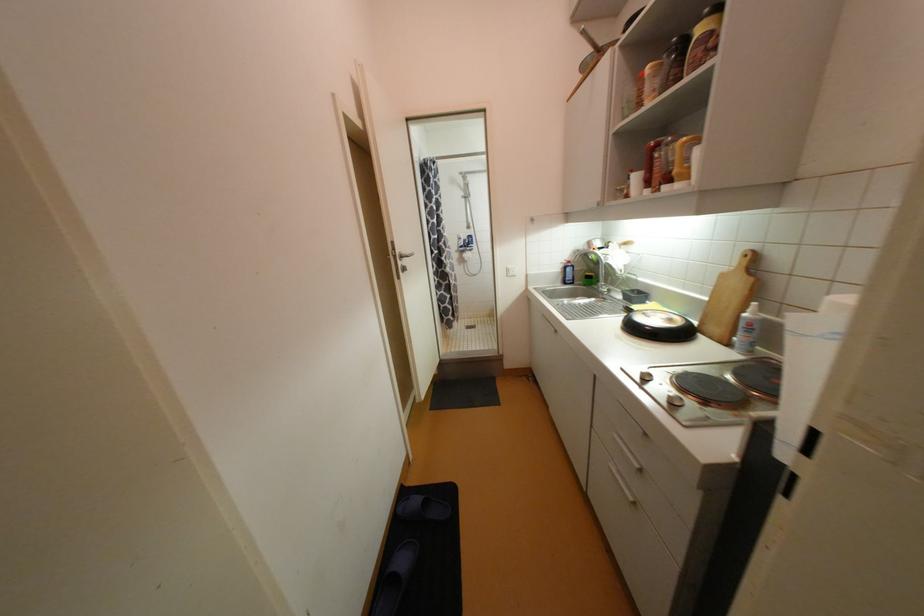
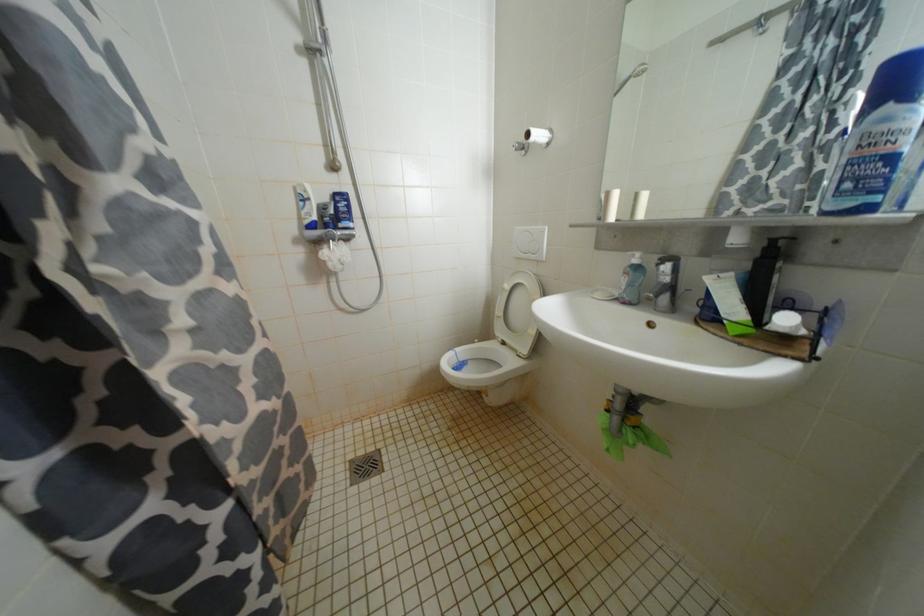
Locate, in the second image, the point that corresponds to [475,238] in the first image.

(345, 198)